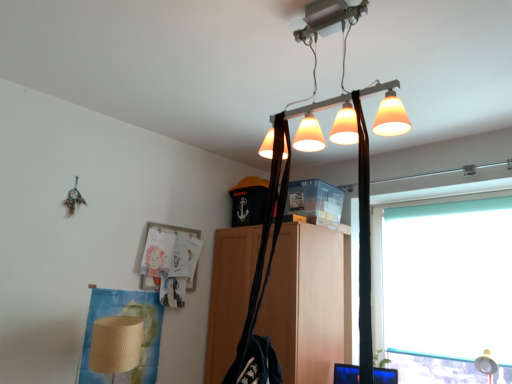
The image size is (512, 384). What do you see at coordinates (306, 303) in the screenshot?
I see `matte wood cabinet at center` at bounding box center [306, 303].

What is the approximate height of matte wood cabinet at center?

The height of matte wood cabinet at center is 1.15 meters.

What do you see at coordinates (486, 365) in the screenshot? The height and width of the screenshot is (384, 512). I see `metallic gold table lamp at lower right` at bounding box center [486, 365].

Where is `matte orange lampshade at upper center`? matte orange lampshade at upper center is located at coordinates (315, 74).

Is teal matte window at right directly adjacent to matte wood cabinet at center?

No, teal matte window at right is not making contact with matte wood cabinet at center.

Locate an element on the screen. The width and height of the screenshot is (512, 384). furniture below the teal matte window at right (from the image's perspective) is located at coordinates (306, 303).

Is teal matte window at right wider or thinner than matte wood cabinet at center?

Considering their sizes, teal matte window at right looks slimmer than matte wood cabinet at center.

From a real-world perspective, which object stands above the other?

teal matte window at right is physically above.

Is black fabric shoulder bag at center wider or thinner than metallic gold table lamp at lower right?

Clearly, black fabric shoulder bag at center has less width compared to metallic gold table lamp at lower right.

Based on their positions, is black fabric shoulder bag at center located to the left or right of metallic gold table lamp at lower right?

Clearly, black fabric shoulder bag at center is on the left of metallic gold table lamp at lower right in the image.

Who is bigger, black fabric shoulder bag at center or metallic gold table lamp at lower right?

black fabric shoulder bag at center is bigger.

Choose the correct answer: Is metallic gold table lamp at lower right inside black fabric shoulder bag at center or outside it?

metallic gold table lamp at lower right cannot be found inside black fabric shoulder bag at center.

Is metallic gold table lamp at lower right facing away from black fabric shoulder bag at center?

No, metallic gold table lamp at lower right's orientation is not away from black fabric shoulder bag at center.

In the image, is metallic gold table lamp at lower right positioned in front of or behind black fabric shoulder bag at center?

In the image, metallic gold table lamp at lower right appears behind black fabric shoulder bag at center.

Is metallic gold table lamp at lower right not close to matte wood cabinet at center?

Absolutely, metallic gold table lamp at lower right is distant from matte wood cabinet at center.

Where is `table lamp below the matte wood cabinet at center (from a real-world perspective)`? The width and height of the screenshot is (512, 384). table lamp below the matte wood cabinet at center (from a real-world perspective) is located at coordinates (486, 365).

What's the angular difference between metallic gold table lamp at lower right and matte wood cabinet at center's facing directions?

1.67 degrees.

From a real-world perspective, which object stands above the other?

matte wood cabinet at center, from a real-world perspective.

Is teal matte window at right turned away from matte orange lampshade at upper center?

No.

Considering the relative positions of teal matte window at right and matte orange lampshade at upper center in the image provided, is teal matte window at right in front of matte orange lampshade at upper center?

No, the depth of teal matte window at right is greater than that of matte orange lampshade at upper center.

From the image's perspective, is teal matte window at right located beneath matte orange lampshade at upper center?

Correct, teal matte window at right appears lower than matte orange lampshade at upper center in the image.

Is matte wood cabinet at center taller than teal matte window at right?

Indeed, matte wood cabinet at center has a greater height compared to teal matte window at right.

From the image's perspective, relative to teal matte window at right, is matte wood cabinet at center above or below?

From the image's perspective, matte wood cabinet at center appears below teal matte window at right.

Does matte wood cabinet at center have a smaller size compared to teal matte window at right?

Actually, matte wood cabinet at center might be larger than teal matte window at right.

Is matte wood cabinet at center positioned far away from teal matte window at right?

No, matte wood cabinet at center is not far from teal matte window at right.

From a real-world perspective, who is located lower, matte wood cabinet at center or metallic gold table lamp at lower right?

metallic gold table lamp at lower right, from a real-world perspective.

Is matte wood cabinet at center not inside metallic gold table lamp at lower right?

Yes.

Is matte wood cabinet at center facing away from metallic gold table lamp at lower right?

No, matte wood cabinet at center is not facing away from metallic gold table lamp at lower right.

Does matte wood cabinet at center have a lesser width compared to metallic gold table lamp at lower right?

No.

Locate an element on the screen. This screenshot has height=384, width=512. furniture that appears below the teal matte window at right (from the image's perspective) is located at coordinates (306, 303).

Where is `table lamp on the right of the black fabric shoulder bag at center`? The image size is (512, 384). table lamp on the right of the black fabric shoulder bag at center is located at coordinates (486, 365).

In the scene shown: Which object lies further to the anchor point black fabric shoulder bag at center, teal matte window at right or matte orange lampshade at upper center?

The object further to black fabric shoulder bag at center is teal matte window at right.

Based on their spatial positions, is teal matte window at right or matte orange lampshade at upper center further from metallic gold table lamp at lower right?

Among the two, matte orange lampshade at upper center is located further to metallic gold table lamp at lower right.

Looking at the image, which one is located further to metallic gold table lamp at lower right, matte wood cabinet at center or matte orange lampshade at upper center?

matte orange lampshade at upper center lies further to metallic gold table lamp at lower right than the other object.

From the image, which object appears to be farther from metallic gold table lamp at lower right, black fabric shoulder bag at center or teal matte window at right?

black fabric shoulder bag at center.

Considering their positions, is matte wood cabinet at center positioned further to black fabric shoulder bag at center than teal matte window at right?

Based on the image, teal matte window at right appears to be further to black fabric shoulder bag at center.

When comparing their distances from matte orange lampshade at upper center, does teal matte window at right or metallic gold table lamp at lower right seem closer?

The object closer to matte orange lampshade at upper center is teal matte window at right.

From the image, which object appears to be nearer to matte orange lampshade at upper center, matte wood cabinet at center or black fabric shoulder bag at center?

black fabric shoulder bag at center is closer to matte orange lampshade at upper center.

Which object lies nearer to the anchor point metallic gold table lamp at lower right, black fabric shoulder bag at center or matte orange lampshade at upper center?

matte orange lampshade at upper center is positioned closer to the anchor metallic gold table lamp at lower right.

Where is `furniture situated between black fabric shoulder bag at center and metallic gold table lamp at lower right from left to right`? furniture situated between black fabric shoulder bag at center and metallic gold table lamp at lower right from left to right is located at coordinates (306, 303).

This screenshot has height=384, width=512. In order to click on window between matte wood cabinet at center and metallic gold table lamp at lower right from left to right in this screenshot , I will do `click(416, 205)`.

This screenshot has width=512, height=384. In order to click on lamp situated between black fabric shoulder bag at center and teal matte window at right from left to right in this screenshot , I will do pos(315,74).

Identify the location of shoulder bag positioned between matte orange lampshade at upper center and matte wood cabinet at center from near to far. The image size is (512, 384). (264, 279).